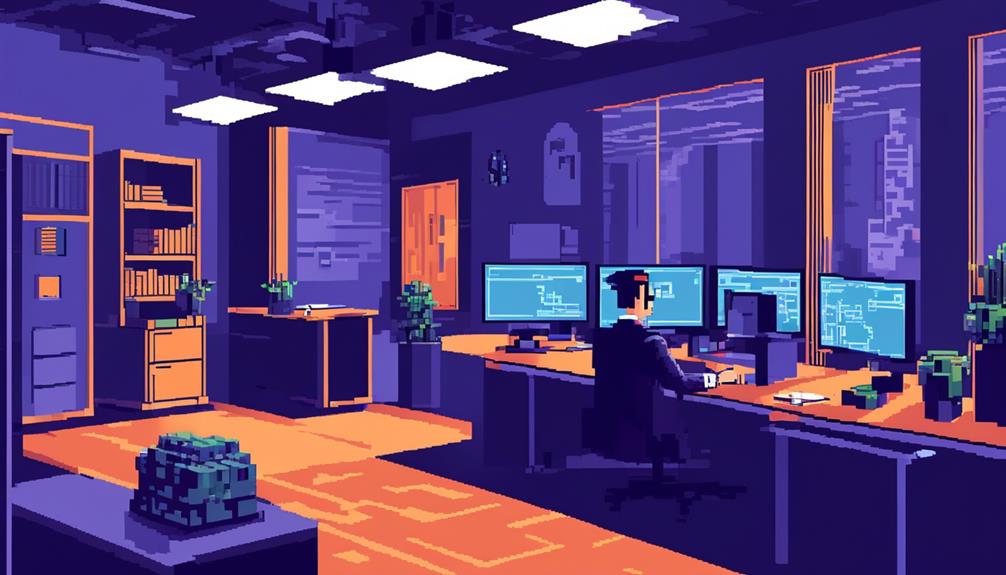
Identify the location of monitors. This screenshot has width=1006, height=575. (527, 290), (670, 294), (770, 283), (863, 302).